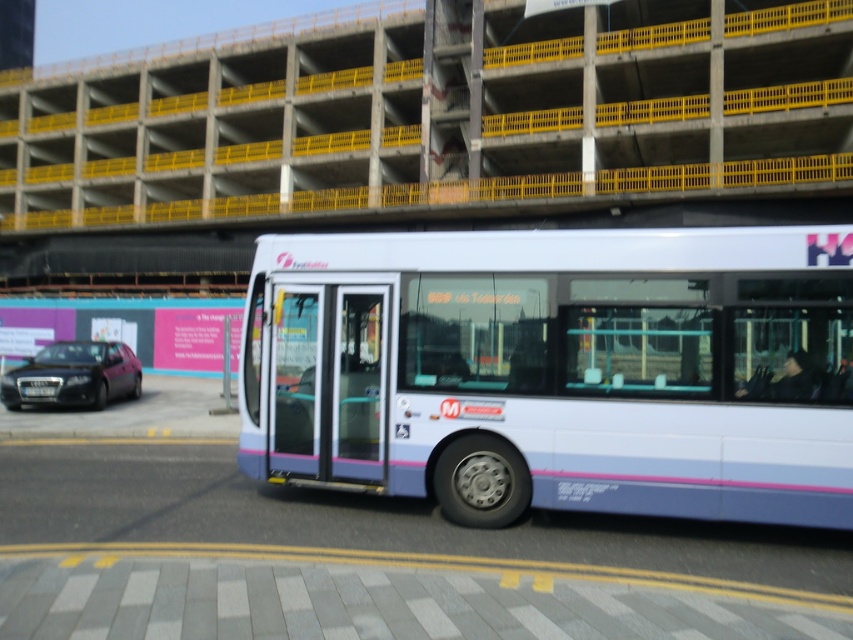
Does white glossy bus at center have a lesser width compared to shiny black sedan at left?

Yes.

Who is positioned more to the left, white glossy bus at center or shiny black sedan at left?

shiny black sedan at left

Between point (819, 324) and point (35, 378), which one is positioned in front?

Point (819, 324) is in front.

Locate an element on the screen. white glossy bus at center is located at coordinates (558, 369).

Is white glossy bus at center below concrete/yellow-railings overpass at upper center?

Correct, white glossy bus at center is located below concrete/yellow-railings overpass at upper center.

Is point (532, 465) in front of point (700, 48)?

Yes, it is.

In order to click on white glossy bus at center in this screenshot , I will do `click(558, 369)`.

Does concrete/yellow-railings overpass at upper center appear on the left side of shiny black sedan at left?

No, concrete/yellow-railings overpass at upper center is not to the left of shiny black sedan at left.

Measure the distance between point (15, 83) and camera.

56.24 meters

Image resolution: width=853 pixels, height=640 pixels. In order to click on concrete/yellow-railings overpass at upper center in this screenshot , I will do `click(436, 115)`.